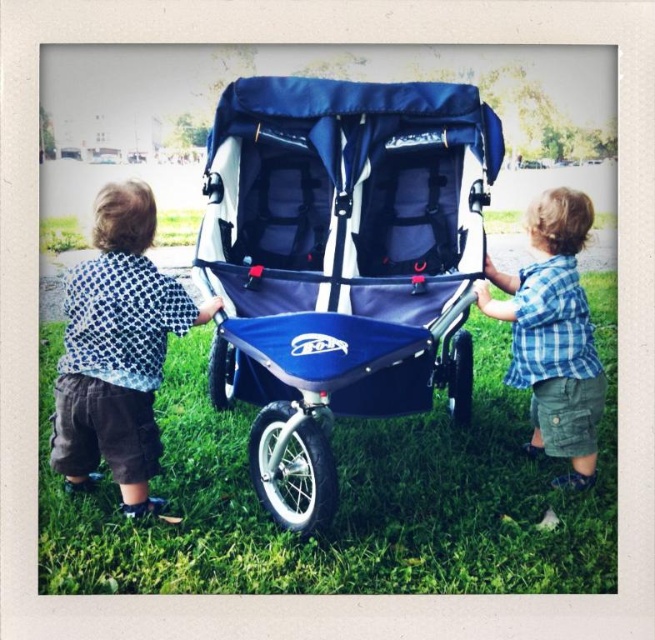
Question: Which object appears farthest from the camera in this image?

Choices:
 (A) green grass at center
 (B) blue fabric stroller at center

Answer: (A)

Question: Is polka dot shirt at left to the left of blue plaid shirt at center from the viewer's perspective?

Choices:
 (A) yes
 (B) no

Answer: (A)

Question: Where is green grass at center located in relation to blue plaid shirt at center in the image?

Choices:
 (A) above
 (B) below

Answer: (B)

Question: Estimate the real-world distances between objects in this image. Which object is closer to the blue fabric stroller at center?

Choices:
 (A) polka dot shirt at left
 (B) green grass at center
 (C) blue plaid shirt at center

Answer: (C)

Question: Does blue fabric stroller at center appear on the right side of blue plaid shirt at center?

Choices:
 (A) yes
 (B) no

Answer: (B)

Question: Which point is closer to the camera taking this photo?

Choices:
 (A) (341, 205)
 (B) (407, 465)
 (C) (527, 364)
 (D) (143, 356)

Answer: (D)